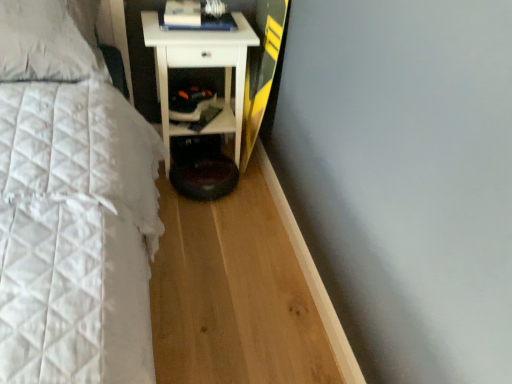
Identify the location of white quilted pillow at upper left. The width and height of the screenshot is (512, 384). click(x=49, y=40).

Identify the location of white glossy cabinet at lower center. (224, 111).

Considering the relative positions of white quilted pillow at upper left and hardcover book at upper center in the image provided, is white quilted pillow at upper left to the left or to the right of hardcover book at upper center?

Clearly, white quilted pillow at upper left is on the left of hardcover book at upper center in the image.

Is point (93, 51) more distant than point (220, 30)?

No, it is in front of (220, 30).

Is white quilted pillow at upper left looking in the opposite direction of hardcover book at upper center?

white quilted pillow at upper left is not turned away from hardcover book at upper center.

Considering the sizes of objects white glossy cabinet at lower center and hardcover book at upper center in the image provided, who is shorter, white glossy cabinet at lower center or hardcover book at upper center?

hardcover book at upper center.

Is white glossy cabinet at lower center not close to hardcover book at upper center?

That's not correct — white glossy cabinet at lower center is a little close to hardcover book at upper center.

From a real-world perspective, who is located higher, white glossy cabinet at lower center or hardcover book at upper center?

hardcover book at upper center.

Which point is more forward, [222,105] or [84,9]?

The point [84,9] is in front.

Considering the relative sizes of white glossy cabinet at lower center and white quilted pillow at upper left in the image provided, is white glossy cabinet at lower center smaller than white quilted pillow at upper left?

Indeed, white glossy cabinet at lower center has a smaller size compared to white quilted pillow at upper left.

Are white glossy cabinet at lower center and white quilted pillow at upper left far apart?

No, white glossy cabinet at lower center is in close proximity to white quilted pillow at upper left.

Find the location of a particular element. pillow in front of the white glossy cabinet at lower center is located at coordinates (49, 40).

Does point (82, 43) appear closer or farther from the camera than point (158, 83)?

Point (82, 43) is closer to the camera than point (158, 83).

Based on the photo, from the image's perspective, which object appears higher, white quilted pillow at upper left or white glossy cabinet at lower center?

white quilted pillow at upper left appears higher in the image.

From the picture: Is white quilted pillow at upper left completely or partially outside of white glossy cabinet at lower center?

That's correct, white quilted pillow at upper left is outside of white glossy cabinet at lower center.

Considering the sizes of objects white quilted pillow at upper left and white glossy cabinet at lower center in the image provided, who is thinner, white quilted pillow at upper left or white glossy cabinet at lower center?

With smaller width is white glossy cabinet at lower center.

Is white quilted pillow at upper left aimed at white glossy nightstand at center?

No, white quilted pillow at upper left is not aimed at white glossy nightstand at center.

Are white quilted pillow at upper left and white glossy nightstand at center making contact?

white quilted pillow at upper left and white glossy nightstand at center are not in contact.

Does white quilted pillow at upper left appear on the right side of white glossy nightstand at center?

No, white quilted pillow at upper left is not to the right of white glossy nightstand at center.

Considering the sizes of objects white quilted pillow at upper left and white glossy nightstand at center in the image provided, who is shorter, white quilted pillow at upper left or white glossy nightstand at center?

white quilted pillow at upper left.

Is white glossy nightstand at center next to white glossy cabinet at lower center and touching it?

Indeed, white glossy nightstand at center and white glossy cabinet at lower center are beside each other and touching.

In terms of width, does white glossy nightstand at center look wider or thinner when compared to white glossy cabinet at lower center?

white glossy nightstand at center is wider than white glossy cabinet at lower center.

Which is in front, point (168, 34) or point (180, 134)?

The point (168, 34) is more forward.

Considering the relative positions of white glossy nightstand at center and white glossy cabinet at lower center in the image provided, is white glossy nightstand at center in front of white glossy cabinet at lower center?

Yes, it is in front of white glossy cabinet at lower center.

From a real-world perspective, is white glossy nightstand at center physically located above or below hardcover book at upper center?

white glossy nightstand at center is below hardcover book at upper center.

From the image's perspective, is white glossy nightstand at center above or below hardcover book at upper center?

From the image's perspective, white glossy nightstand at center appears below hardcover book at upper center.

Is white glossy nightstand at center positioned far away from hardcover book at upper center?

No, there isn't a large distance between white glossy nightstand at center and hardcover book at upper center.

Find the location of a particular element. Image resolution: width=512 pixels, height=384 pixels. pillow on the left side of hardcover book at upper center is located at coordinates (49, 40).

What are the coordinates of `cabinet below the hardcover book at upper center (from the image's perspective)` in the screenshot? It's located at (224, 111).

Considering their positions, is white quilted pillow at upper left positioned further to white glossy nightstand at center than hardcover book at upper center?

The object further to white glossy nightstand at center is white quilted pillow at upper left.

Which object lies nearer to the anchor point white glossy nightstand at center, hardcover book at upper center or white quilted pillow at upper left?

Among the two, hardcover book at upper center is located nearer to white glossy nightstand at center.

From the image, which object appears to be farther from white quilted pillow at upper left, hardcover book at upper center or white glossy nightstand at center?

hardcover book at upper center.

Considering their positions, is hardcover book at upper center positioned further to white glossy cabinet at lower center than white quilted pillow at upper left?

white quilted pillow at upper left is positioned further to the anchor white glossy cabinet at lower center.

From the image, which object appears to be nearer to white glossy cabinet at lower center, white glossy nightstand at center or hardcover book at upper center?

white glossy nightstand at center is closer to white glossy cabinet at lower center.

Consider the image. Estimate the real-world distances between objects in this image. Which object is further from white glossy nightstand at center, white glossy cabinet at lower center or hardcover book at upper center?

Among the two, hardcover book at upper center is located further to white glossy nightstand at center.

Looking at the image, which one is located further to white glossy nightstand at center, hardcover book at upper center or white glossy cabinet at lower center?

hardcover book at upper center.

Looking at the image, which one is located further to white quilted pillow at upper left, white glossy nightstand at center or hardcover book at upper center?

hardcover book at upper center is positioned further to the anchor white quilted pillow at upper left.

This screenshot has height=384, width=512. In order to click on cabinet between hardcover book at upper center and white glossy nightstand at center vertically in this screenshot , I will do `click(224, 111)`.

You are a GUI agent. You are given a task and a screenshot of the screen. Output one action in this format:
    pyautogui.click(x=<x>, y=<y>)
    Task: Click on the nightstand between white quilted pillow at upper left and hardcover book at upper center from left to right
    This screenshot has height=384, width=512.
    Given the screenshot: What is the action you would take?
    tap(202, 67)

This screenshot has height=384, width=512. In order to click on book between white quilted pillow at upper left and white glossy cabinet at lower center from front to back in this screenshot , I will do `click(196, 16)`.

Image resolution: width=512 pixels, height=384 pixels. I want to click on nightstand between white quilted pillow at upper left and white glossy cabinet at lower center in the front-back direction, so click(202, 67).